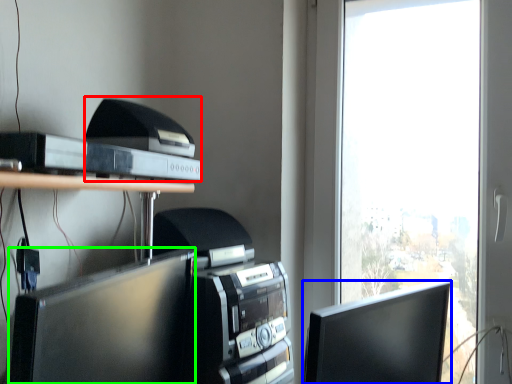
Question: Which is farther away from printer (highlighted by a red box)? computer monitor (highlighted by a blue box) or computer monitor (highlighted by a green box)?

Choices:
 (A) computer monitor
 (B) computer monitor

Answer: (A)